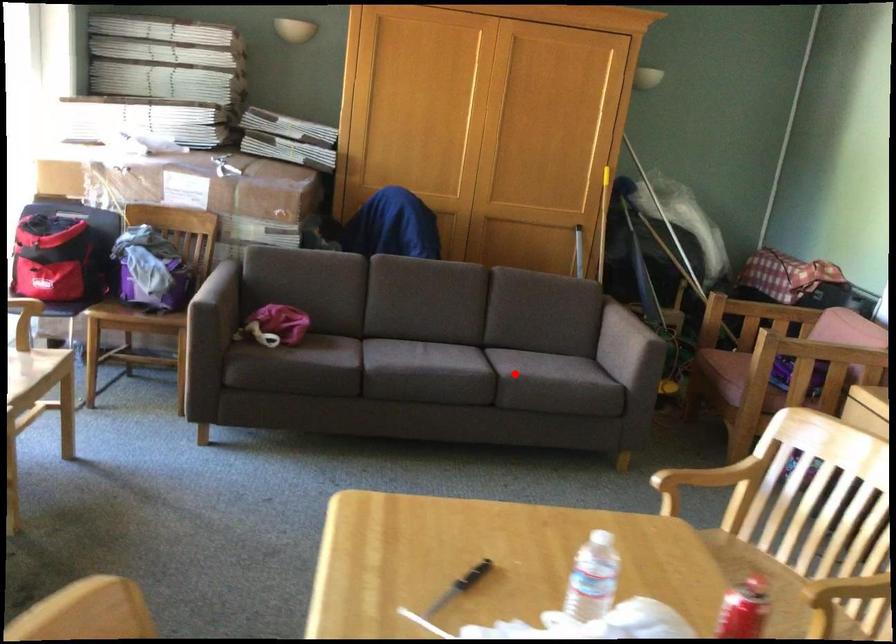
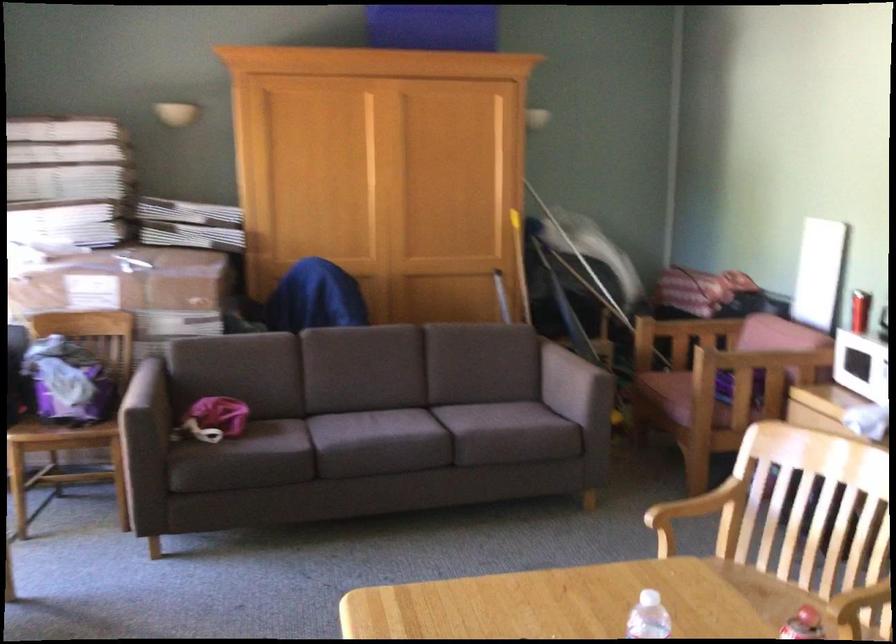
In the second image, find the point that corresponds to the highlighted location in the first image.

(467, 430)